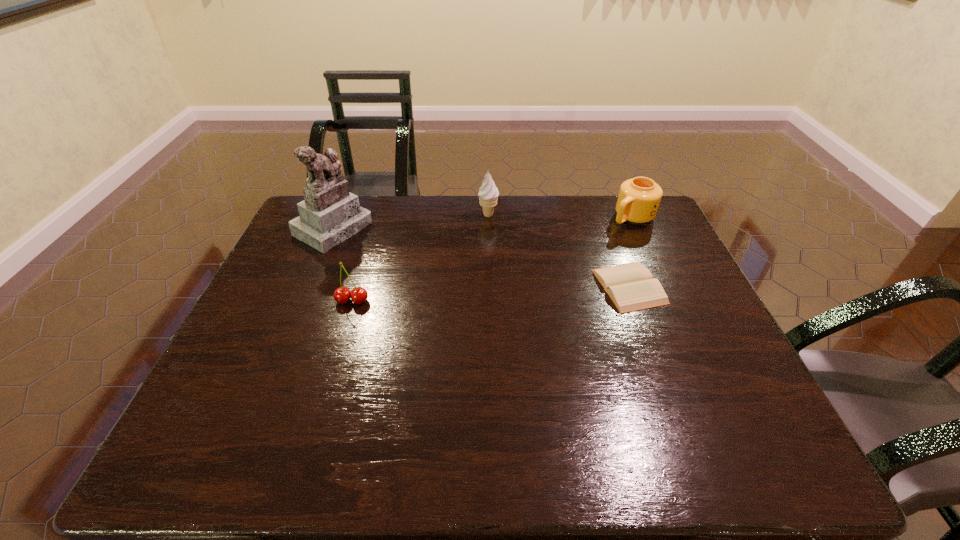
The image size is (960, 540). I want to click on cherry, so click(358, 295).

You are a GUI agent. You are given a task and a screenshot of the screen. Output one action in this format:
    pyautogui.click(x=<x>, y=<y>)
    Task: Click on the diary
    Image resolution: width=960 pixels, height=540 pixels.
    Given the screenshot: What is the action you would take?
    click(630, 286)

This screenshot has width=960, height=540. Identify the location of figurine. (329, 214).

At what (x,y) coordinates should I click in order to perform the action: click on the third object from left to right. Please return your answer as a coordinate pair (x, y). The image size is (960, 540). Looking at the image, I should click on click(x=488, y=194).

Where is `the fourth shortest object`? This screenshot has width=960, height=540. the fourth shortest object is located at coordinates (488, 194).

Identify the location of mug. (639, 198).

The image size is (960, 540). In order to click on free point located 0.270m with the stems of the cherry pointing upwards in this screenshot , I will do `click(324, 397)`.

Where is `free space located on the right of the shortest object`? free space located on the right of the shortest object is located at coordinates (691, 286).

Locate an element on the screen. free space located on the front-facing side of the figurine is located at coordinates [x=393, y=262].

The image size is (960, 540). Identify the location of blank space located on the front-facing side of the figurine. (383, 256).